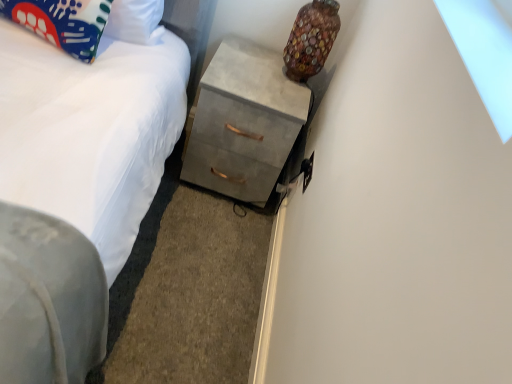
Question: Considering the relative sizes of multicolored glass vase at upper right and matte fabric pillow at upper left in the image provided, is multicolored glass vase at upper right taller than matte fabric pillow at upper left?

Choices:
 (A) yes
 (B) no

Answer: (A)

Question: From the image's perspective, is multicolored glass vase at upper right located beneath matte fabric pillow at upper left?

Choices:
 (A) no
 (B) yes

Answer: (B)

Question: Could matte fabric pillow at upper left be considered to be inside multicolored glass vase at upper right?

Choices:
 (A) no
 (B) yes

Answer: (A)

Question: Can you see multicolored glass vase at upper right touching matte fabric pillow at upper left?

Choices:
 (A) yes
 (B) no

Answer: (B)

Question: Is multicolored glass vase at upper right to the left of matte fabric pillow at upper left from the viewer's perspective?

Choices:
 (A) yes
 (B) no

Answer: (B)

Question: Is point (239, 104) positioned closer to the camera than point (10, 119)?

Choices:
 (A) closer
 (B) farther

Answer: (B)

Question: From a real-world perspective, is concrete gray chest of drawers at center above or below white fabric bed at lower left?

Choices:
 (A) below
 (B) above

Answer: (B)

Question: Would you say concrete gray chest of drawers at center is to the left or to the right of white fabric bed at lower left in the picture?

Choices:
 (A) left
 (B) right

Answer: (B)

Question: Considering the positions of concrete gray chest of drawers at center and white fabric bed at lower left in the image, is concrete gray chest of drawers at center wider or thinner than white fabric bed at lower left?

Choices:
 (A) thin
 (B) wide

Answer: (A)

Question: Considering the positions of white fabric bed at lower left and matte fabric pillow at upper left in the image, is white fabric bed at lower left wider or thinner than matte fabric pillow at upper left?

Choices:
 (A) wide
 (B) thin

Answer: (A)

Question: Is white fabric bed at lower left to the left or to the right of matte fabric pillow at upper left in the image?

Choices:
 (A) left
 (B) right

Answer: (B)

Question: Is white fabric bed at lower left taller or shorter than matte fabric pillow at upper left?

Choices:
 (A) short
 (B) tall

Answer: (A)

Question: From the image's perspective, is white fabric bed at lower left located above or below matte fabric pillow at upper left?

Choices:
 (A) above
 (B) below

Answer: (B)

Question: Is multicolored glass vase at upper right inside the boundaries of matte fabric pillow at upper left, or outside?

Choices:
 (A) inside
 (B) outside

Answer: (B)

Question: Does point (305, 69) appear closer or farther from the camera than point (81, 13)?

Choices:
 (A) closer
 (B) farther

Answer: (B)